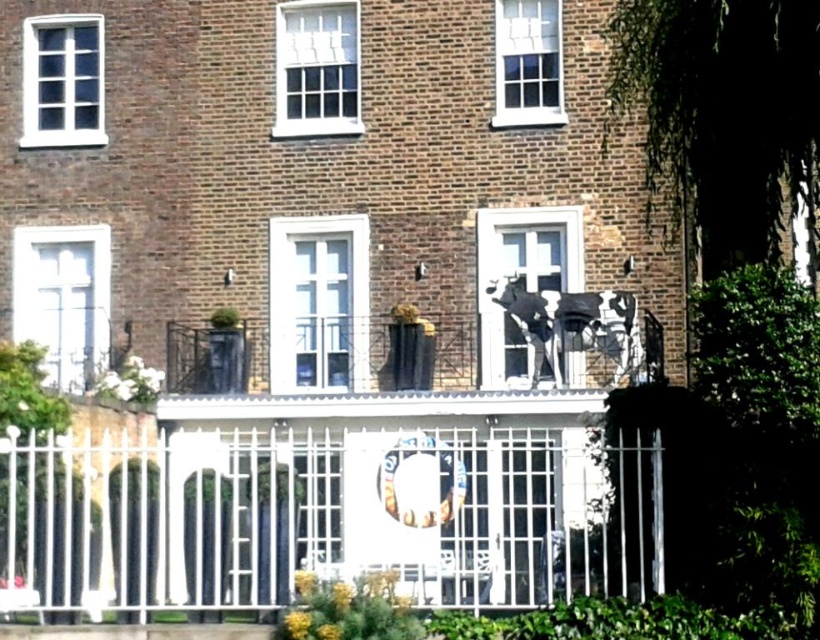
Question: Considering the real-world distances, which object is farthest from the white wooden window at upper center?

Choices:
 (A) metallic cow at center
 (B) white glass window at center
 (C) clear glass window at upper center
 (D) white glass cross at left

Answer: (D)

Question: Among these objects, which one is farthest from the camera?

Choices:
 (A) white metal fence at center
 (B) white glass window at center

Answer: (B)

Question: Does white glass cross at left appear on the left side of white wooden window at upper left?

Choices:
 (A) yes
 (B) no

Answer: (B)

Question: Is white painted metal balcony at center smaller than white wooden window at upper left?

Choices:
 (A) yes
 (B) no

Answer: (B)

Question: Does white wooden window at upper center lie behind white painted metal balcony at center?

Choices:
 (A) no
 (B) yes

Answer: (B)

Question: Which of the following is the farthest from the observer?

Choices:
 (A) (486, 348)
 (B) (292, 506)
 (C) (87, 35)
 (D) (51, 348)

Answer: (C)